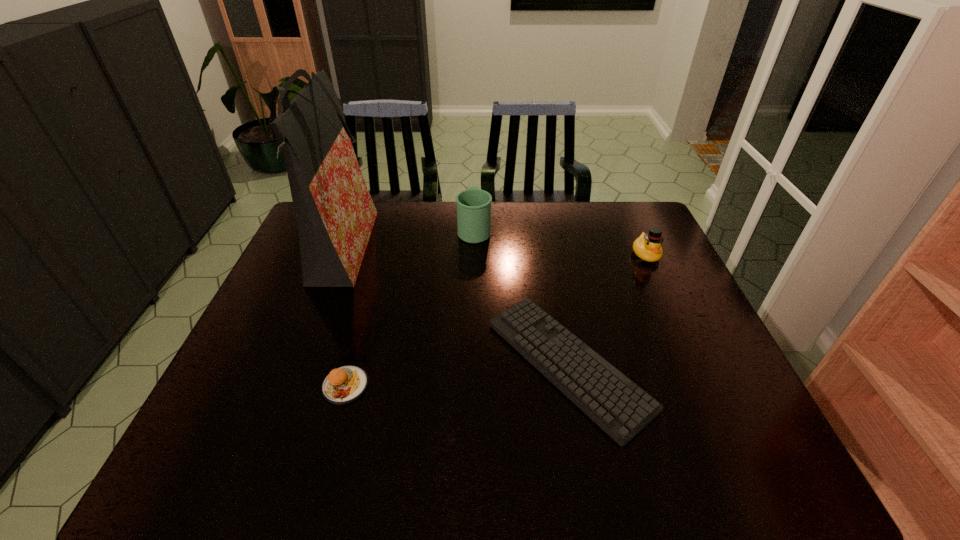
Locate an element on the screen. This screenshot has width=960, height=540. vacant space at the near left corner of the desktop is located at coordinates (189, 481).

You are a GUI agent. You are given a task and a screenshot of the screen. Output one action in this format:
    pyautogui.click(x=<x>, y=<y>)
    Task: Click on the vacant space at the far right corner of the desktop
    
    Given the screenshot: What is the action you would take?
    click(607, 213)

In order to click on free area in between the shopping bag and the computer keyboard in this screenshot , I will do `click(454, 308)`.

This screenshot has width=960, height=540. I want to click on unoccupied area between the mug and the shopping bag, so click(407, 240).

At what (x,y) coordinates should I click in order to perform the action: click on free space between the mug and the patty. Please return your answer as a coordinate pair (x, y). This screenshot has width=960, height=540. Looking at the image, I should click on (410, 307).

You are a GUI agent. You are given a task and a screenshot of the screen. Output one action in this format:
    pyautogui.click(x=<x>, y=<y>)
    Task: Click on the free space between the shortest object and the tallest object
    Image resolution: width=960 pixels, height=540 pixels.
    Given the screenshot: What is the action you would take?
    pyautogui.click(x=454, y=308)

Where is `free spot between the shopping bag and the third shortest object`? The height and width of the screenshot is (540, 960). free spot between the shopping bag and the third shortest object is located at coordinates [x=492, y=253].

Find the location of `vacant space that is in between the mug and the patty`. vacant space that is in between the mug and the patty is located at coordinates (410, 307).

The height and width of the screenshot is (540, 960). In order to click on vacant area that lies between the fourth tallest object and the second tallest object in this screenshot , I will do `click(410, 307)`.

Locate an element on the screen. vacant area between the patty and the mug is located at coordinates (410, 307).